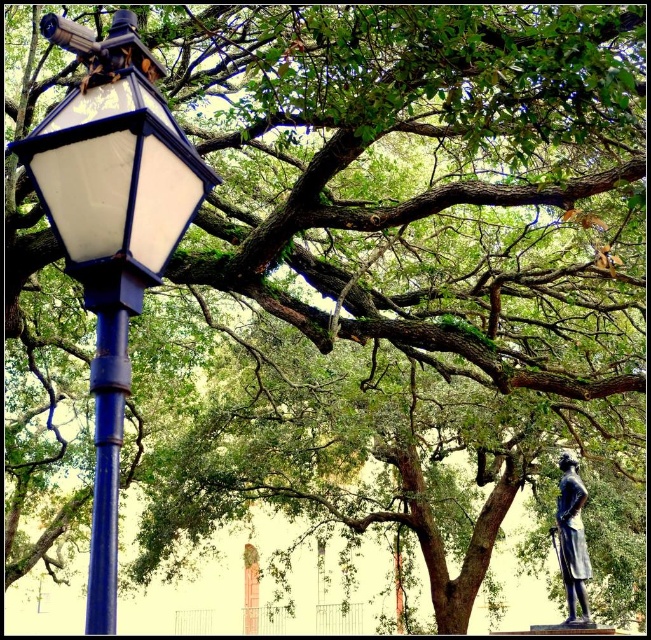
Question: Can you confirm if blue metallic pole at left is bigger than bronze statue at lower right?

Choices:
 (A) no
 (B) yes

Answer: (A)

Question: Which object appears farthest from the camera in this image?

Choices:
 (A) blue metallic pole at left
 (B) matte blue streetlight at left

Answer: (A)

Question: Which is farther from the blue metallic pole at left?

Choices:
 (A) matte blue streetlight at left
 (B) bronze statue at lower right

Answer: (B)

Question: Does blue metallic pole at left appear over bronze statue at lower right?

Choices:
 (A) yes
 (B) no

Answer: (A)

Question: Is matte blue streetlight at left below blue metallic pole at left?

Choices:
 (A) yes
 (B) no

Answer: (B)

Question: Which object appears farthest from the camera in this image?

Choices:
 (A) blue metallic pole at left
 (B) matte blue streetlight at left

Answer: (A)